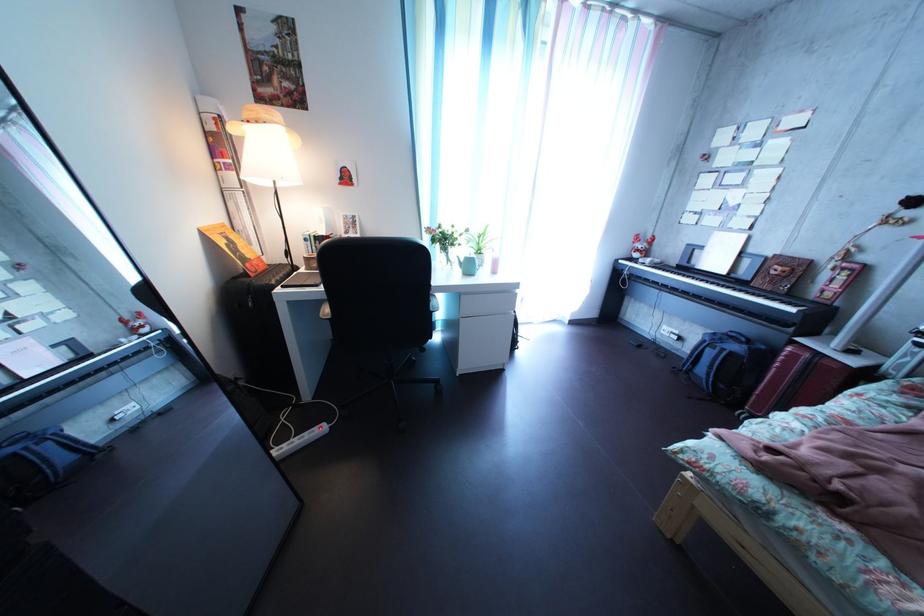
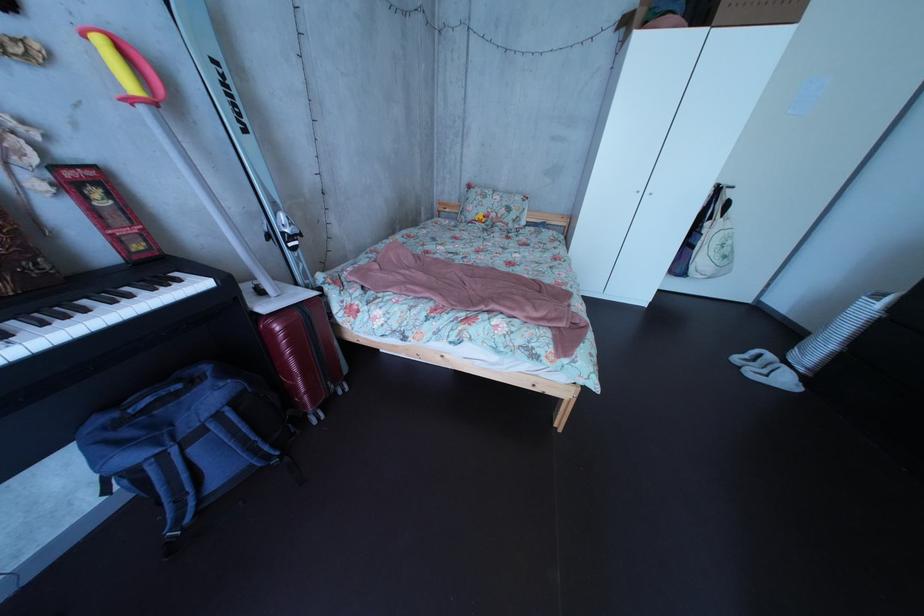
Locate, in the second image, the point that corresponds to point 822,363 in the first image.

(311, 322)